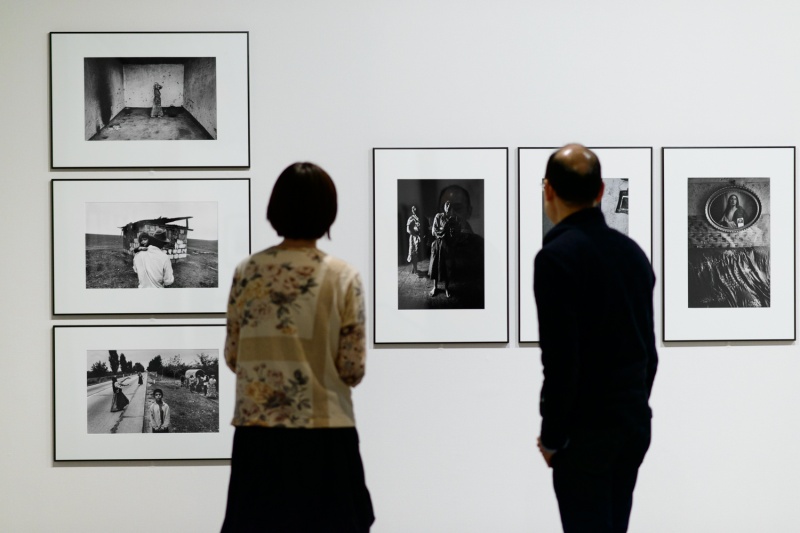
The image size is (800, 533). I want to click on shadow under framed photographs, so click(772, 342), click(482, 344), click(165, 461).